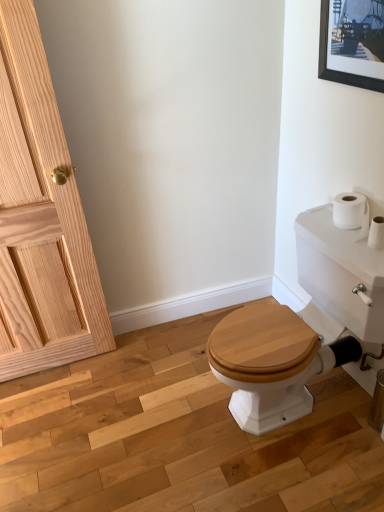
The height and width of the screenshot is (512, 384). What are the coordinates of `free spot to the left of white glossy porcelain at right` in the screenshot? It's located at [155, 410].